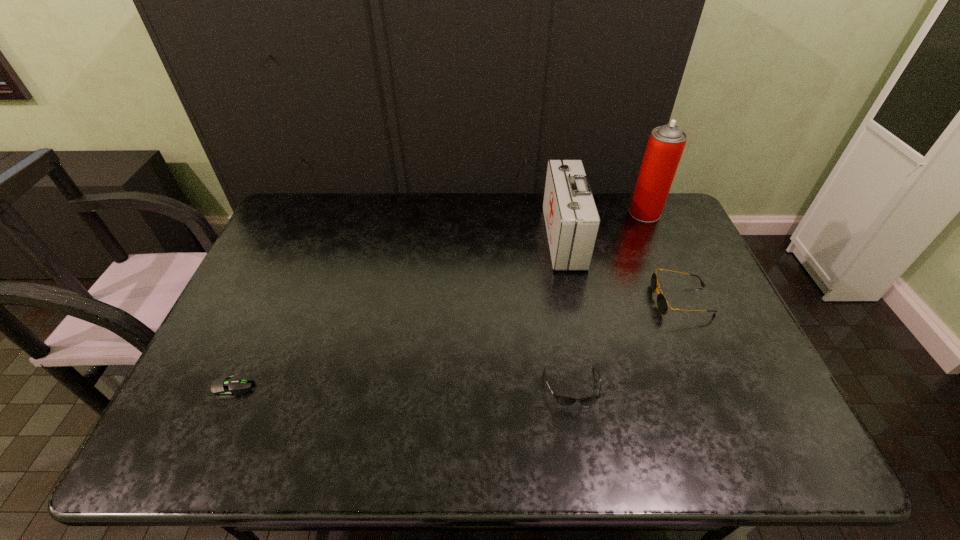
The image size is (960, 540). What are the coordinates of `aerosol can that is at the right edge` in the screenshot? It's located at (666, 144).

Where is `sunglasses located at the right edge`? The width and height of the screenshot is (960, 540). sunglasses located at the right edge is located at coordinates (662, 304).

The height and width of the screenshot is (540, 960). What are the coordinates of `object that is at the far right corner` in the screenshot? It's located at (666, 144).

Identify the location of vacant space at the far edge of the desktop. The width and height of the screenshot is (960, 540). (405, 195).

Where is `vacant space at the left edge of the desktop`? This screenshot has width=960, height=540. vacant space at the left edge of the desktop is located at coordinates (201, 388).

Locate an element on the screen. This screenshot has height=540, width=960. vacant space at the right edge of the desktop is located at coordinates (734, 399).

Locate an element on the screen. vacant space at the far left corner of the desktop is located at coordinates (329, 201).

Find the location of `free space between the first-aid kit and the shorter sunglasses`. free space between the first-aid kit and the shorter sunglasses is located at coordinates (568, 313).

I want to click on vacant area that lies between the right sunglasses and the second tallest object, so click(623, 269).

Find the location of `empty space that is in between the computer mouse and the first-aid kit`. empty space that is in between the computer mouse and the first-aid kit is located at coordinates (398, 312).